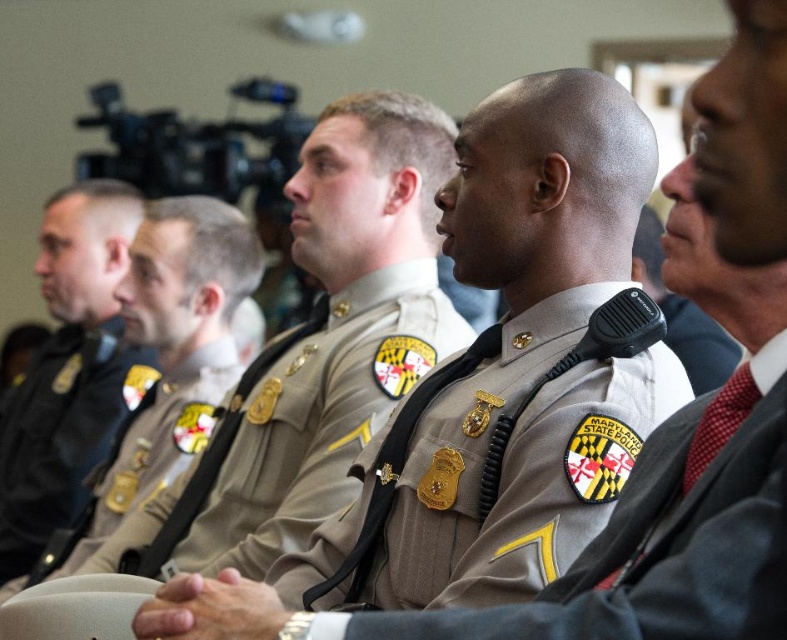
Which of these two, red silk tie at center or red checkered tie at right, stands shorter?

With less height is red checkered tie at right.

Who is more distant from viewer, (741, 381) or (723, 401)?

The point (723, 401) is more distant.

Where is `red silk tie at center`? This screenshot has width=787, height=640. red silk tie at center is located at coordinates (719, 422).

The height and width of the screenshot is (640, 787). I want to click on red silk tie at center, so click(719, 422).

Who is shorter, tan/striped fabric uniform at center or red silk tie at center?

red silk tie at center

Which is in front, point (372, 273) or point (704, 440)?

Point (704, 440) is in front.

Locate an element on the screen. The width and height of the screenshot is (787, 640). tan/striped fabric uniform at center is located at coordinates (318, 419).

Between tan fabric uniform at center and matte black uniform at left, which one appears on the right side from the viewer's perspective?

Positioned to the right is tan fabric uniform at center.

Where is `tan fabric uniform at center`? tan fabric uniform at center is located at coordinates (494, 464).

Which is in front, point (475, 536) or point (102, 372)?

Point (475, 536)

I want to click on tan fabric uniform at center, so click(x=494, y=464).